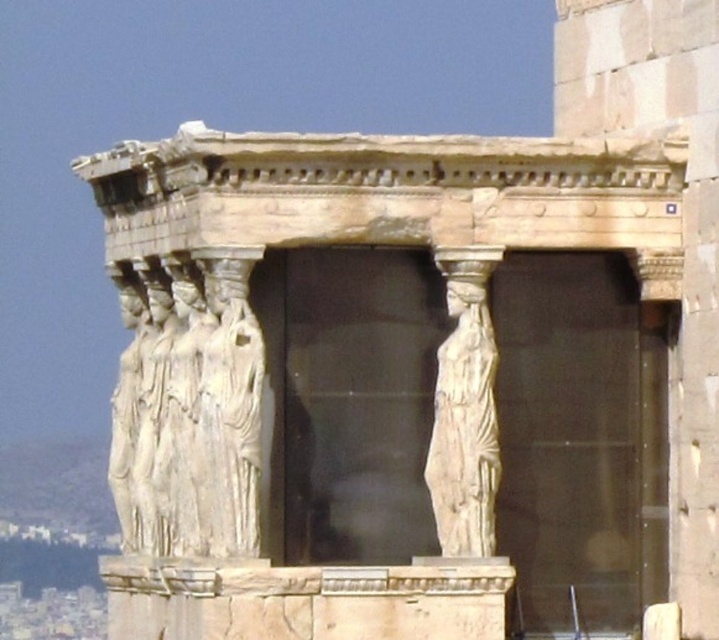
Based on the provided scene description, where exactly are the white marble statues at center located in terms of coordinates?

The white marble statues at center are located at point coordinates of (188, 412).